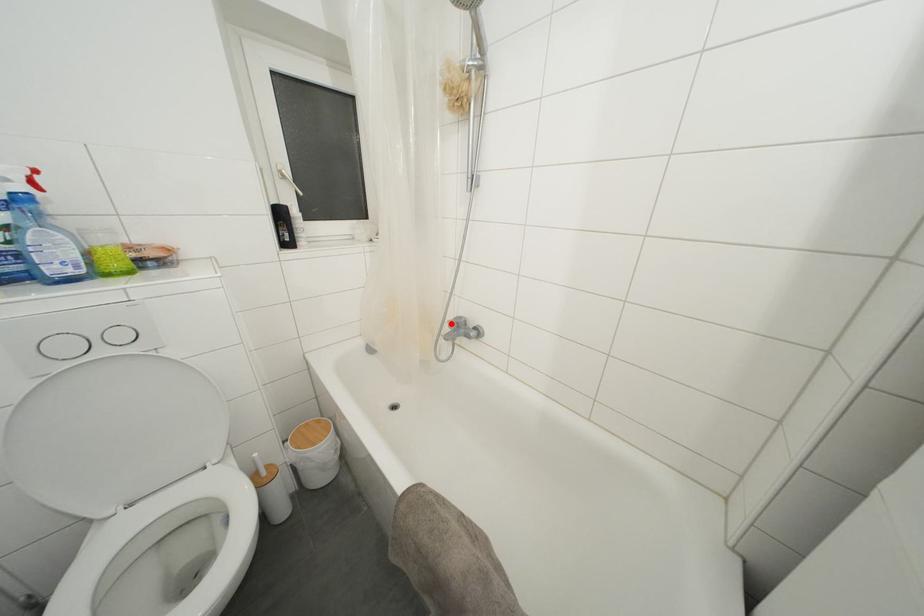
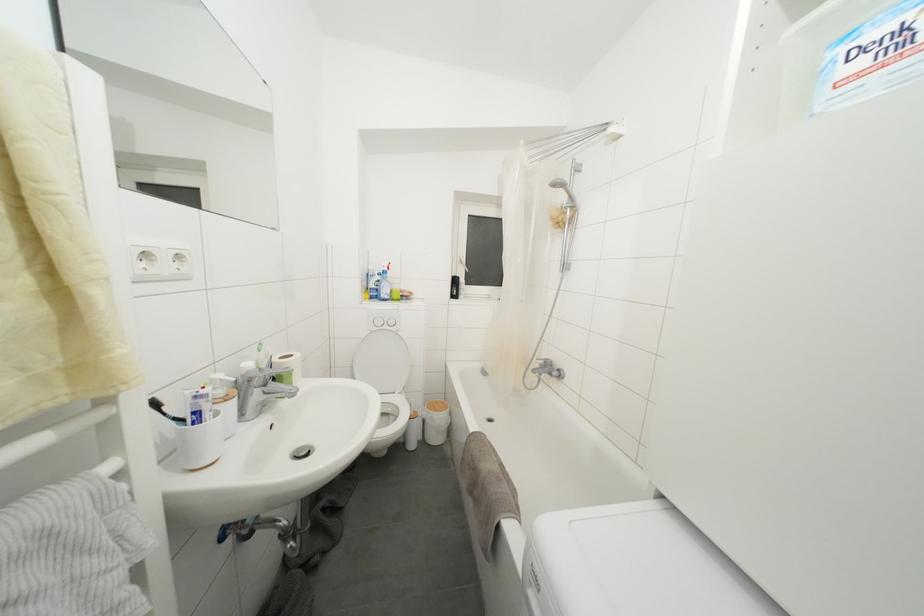
Locate, in the second image, the point that corresponds to the highlighted location in the first image.

(540, 362)